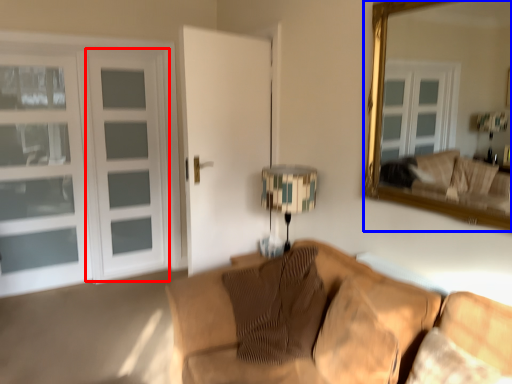
Question: Among these objects, which one is farthest to the camera, screen door (highlighted by a red box) or mirror (highlighted by a blue box)?

Choices:
 (A) screen door
 (B) mirror

Answer: (A)